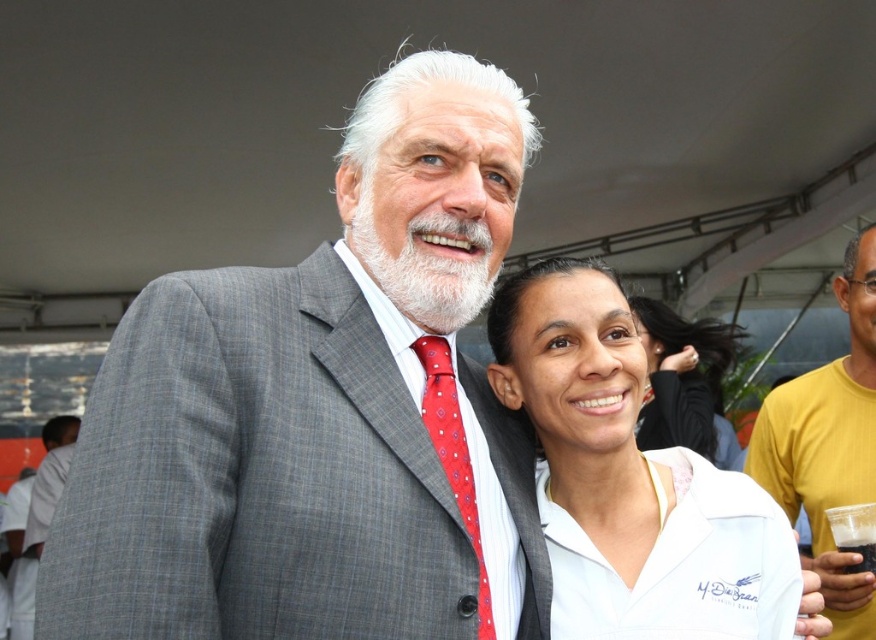
Question: Is gray textured suit at center behind yellow cotton t-shirt at right?

Choices:
 (A) yes
 (B) no

Answer: (B)

Question: In this image, where is gray textured suit at center located relative to yellow cotton t-shirt at right?

Choices:
 (A) left
 (B) right

Answer: (A)

Question: Which point appears closest to the camera in this image?

Choices:
 (A) (553, 627)
 (B) (677, 394)
 (C) (442, 384)

Answer: (C)

Question: Estimate the real-world distances between objects in this image. Which object is closer to the yellow cotton t-shirt at right?

Choices:
 (A) red silk tie at center
 (B) gray wool suit at upper left
 (C) white cotton shirt at center

Answer: (C)

Question: Which of the following is the closest to the observer?

Choices:
 (A) gray textured suit at center
 (B) yellow cotton t-shirt at right
 (C) gray wool suit at upper left
 (D) red silk tie at center

Answer: (A)

Question: Can you confirm if gray textured suit at center is bigger than yellow cotton t-shirt at right?

Choices:
 (A) yes
 (B) no

Answer: (A)